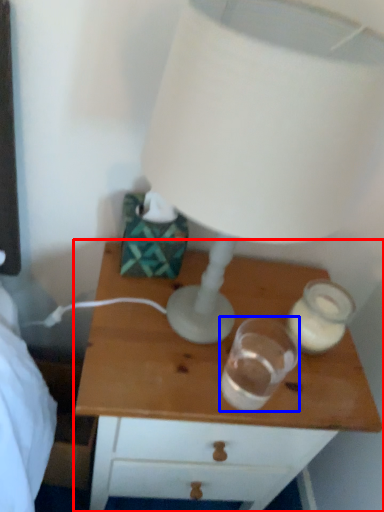
Question: Which object is closer to the camera taking this photo, nightstand (highlighted by a red box) or candle holder (highlighted by a blue box)?

Choices:
 (A) nightstand
 (B) candle holder

Answer: (B)